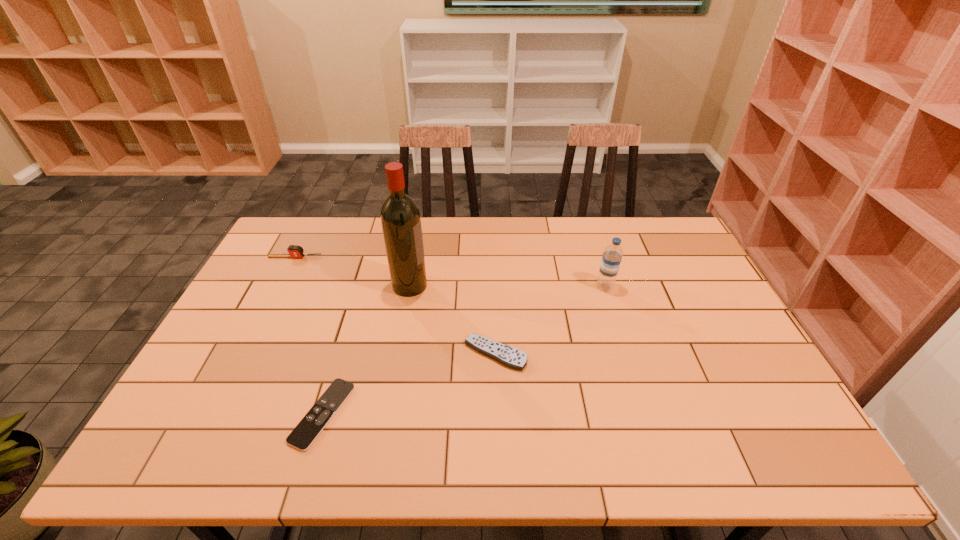
The height and width of the screenshot is (540, 960). I want to click on the third object from left to right, so click(400, 218).

Identify the location of wine bottle. (400, 218).

Locate an element on the screen. The height and width of the screenshot is (540, 960). the second tallest object is located at coordinates (612, 255).

You are a GUI agent. You are given a task and a screenshot of the screen. Output one action in this format:
    pyautogui.click(x=<x>, y=<y>)
    Task: Click on the rightmost object
    This screenshot has height=540, width=960.
    Given the screenshot: What is the action you would take?
    pyautogui.click(x=612, y=255)

Locate an element on the screen. Image resolution: width=960 pixels, height=540 pixels. the leftmost object is located at coordinates (295, 251).

Locate an element on the screen. The height and width of the screenshot is (540, 960). the third shortest object is located at coordinates tap(295, 251).

The height and width of the screenshot is (540, 960). In order to click on the fourth farthest object in this screenshot , I will do `click(509, 356)`.

Where is `the fourth tallest object`? the fourth tallest object is located at coordinates (509, 356).

Where is `the left remote control`? the left remote control is located at coordinates (304, 434).

This screenshot has height=540, width=960. Find the location of `the shortest object`. the shortest object is located at coordinates pos(304,434).